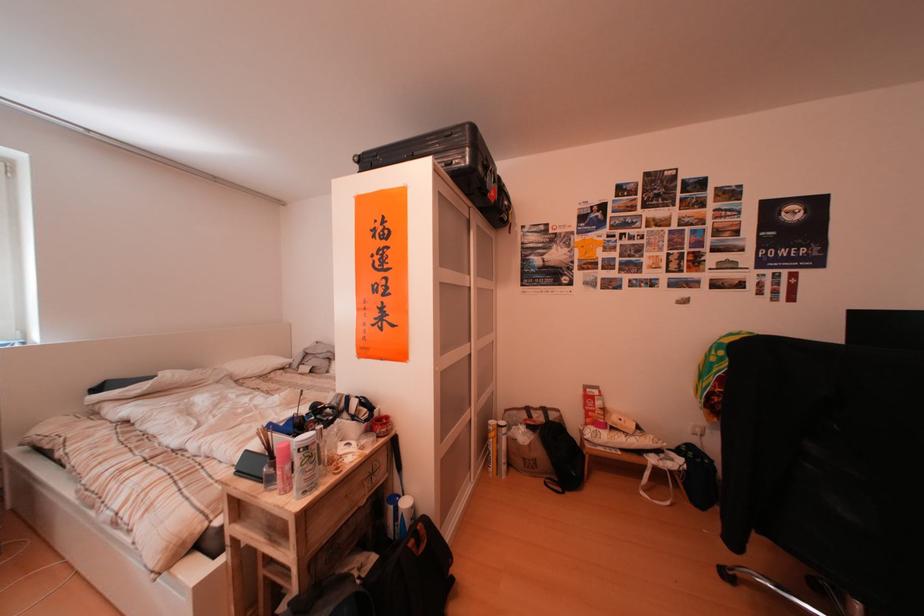
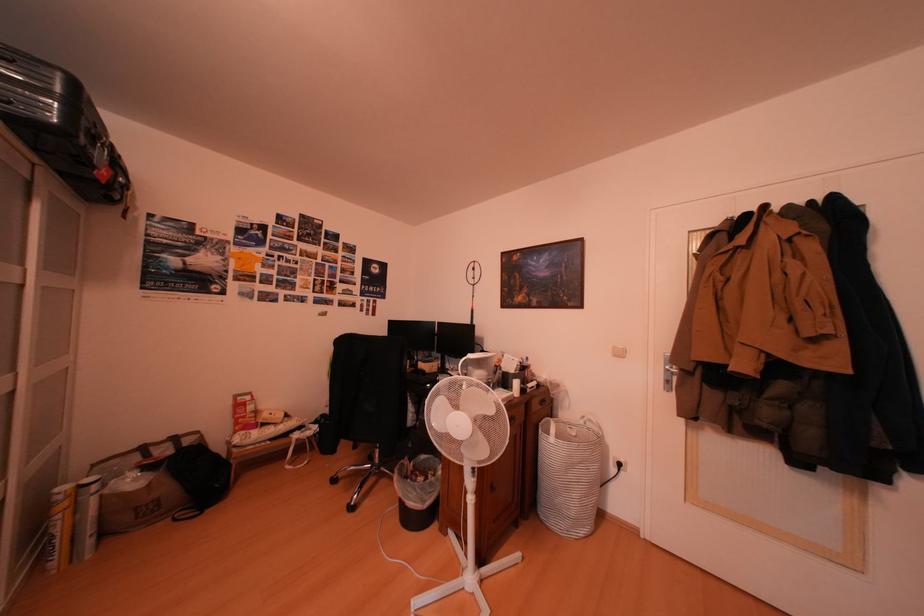
Find the pixel in the second image that matches (x=542, y=422) in the first image.

(161, 461)